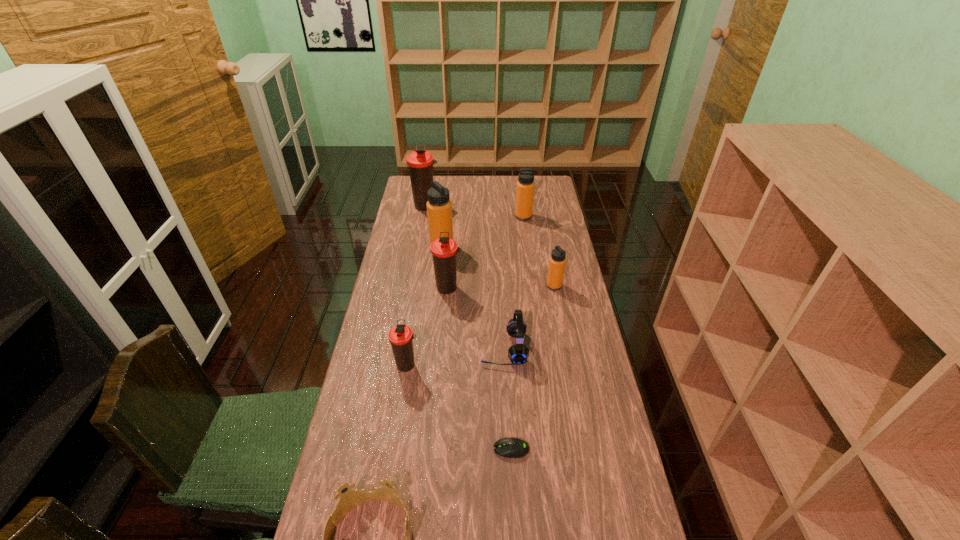
This screenshot has width=960, height=540. I want to click on the farthest brown thermos bottle, so pos(420,162).

The width and height of the screenshot is (960, 540). I want to click on the leftmost orange thermos bottle, so click(x=439, y=208).

Identify the location of the third farthest object. (439, 208).

You are a GUI agent. You are given a task and a screenshot of the screen. Output one action in this format:
    pyautogui.click(x=<x>, y=<y>)
    Task: Click on the farthest orange thermos bottle
    The image size is (960, 540).
    Given the screenshot: What is the action you would take?
    pyautogui.click(x=525, y=186)

Locate an element on the screen. the second object from right to left is located at coordinates (525, 186).

This screenshot has width=960, height=540. I want to click on the second biggest brown thermos bottle, so click(444, 249).

The width and height of the screenshot is (960, 540). What are the coordinates of `the rightmost brown thermos bottle` in the screenshot? It's located at (444, 249).

Identify the location of the smallest brown thermos bottle. (400, 336).

Where is `the nearest brown thermos bottle`? Image resolution: width=960 pixels, height=540 pixels. the nearest brown thermos bottle is located at coordinates (400, 336).

The image size is (960, 540). I want to click on the rightmost thermos bottle, so click(557, 261).